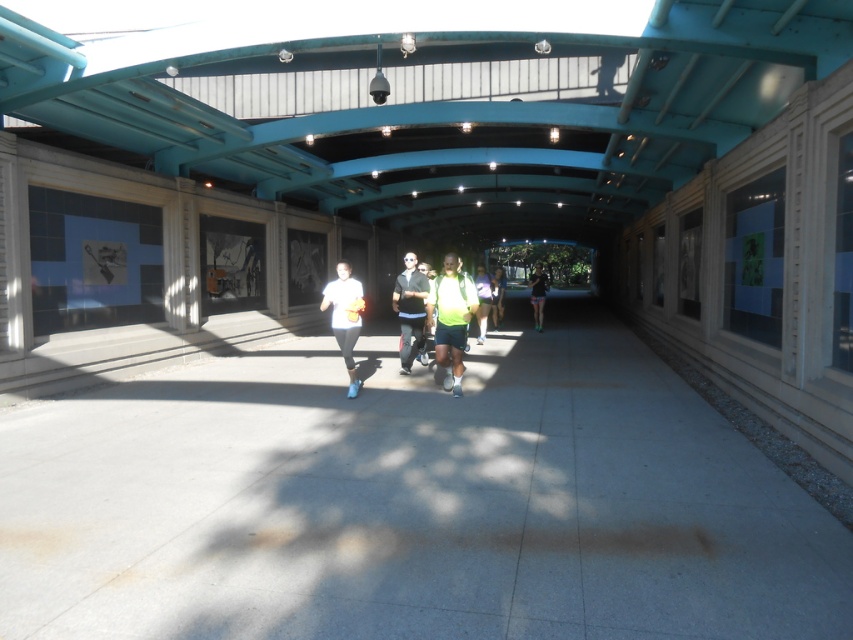
Question: Is green reflective shorts at center below green reflective vest at center?

Choices:
 (A) yes
 (B) no

Answer: (A)

Question: Is gray concrete pavement at center behind green reflective shorts at center?

Choices:
 (A) yes
 (B) no

Answer: (B)

Question: Considering the real-world distances, which object is closest to the green reflective vest at center?

Choices:
 (A) green reflective shorts at center
 (B) neon yellow reflective vest at center

Answer: (A)

Question: Which of these objects is positioned farthest from the gray concrete pavement at center?

Choices:
 (A) neon yellow reflective vest at center
 (B) neon green fabric at center
 (C) matte black jacket at center
 (D) green reflective shorts at center

Answer: (D)

Question: Among these points, which one is farthest from the camera?

Choices:
 (A) (531, 273)
 (B) (503, 276)
 (C) (486, 317)
 (D) (440, 300)

Answer: (A)

Question: From the image, what is the correct spatial relationship of neon yellow reflective vest at center in relation to green reflective shorts at center?

Choices:
 (A) below
 (B) above

Answer: (A)